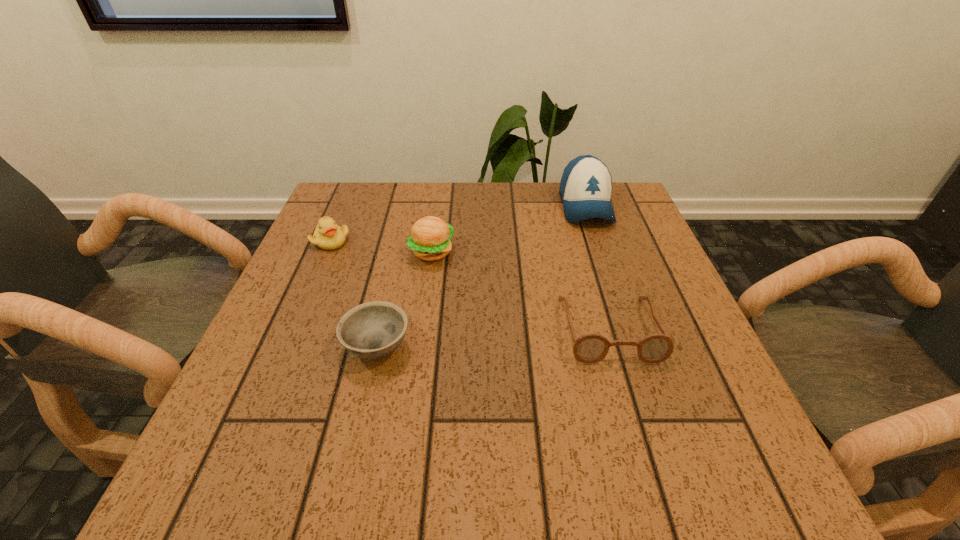
Locate an element on the screen. The height and width of the screenshot is (540, 960). vacant space positioned 0.130m on the right of the bowl is located at coordinates (480, 347).

The width and height of the screenshot is (960, 540). In order to click on object present at the far edge in this screenshot , I will do `click(585, 188)`.

Image resolution: width=960 pixels, height=540 pixels. What are the coordinates of `object present at the left edge` in the screenshot? It's located at (328, 236).

Where is `baseball cap located in the right edge section of the desktop`? Image resolution: width=960 pixels, height=540 pixels. baseball cap located in the right edge section of the desktop is located at coordinates (585, 188).

Where is `spectacles present at the right edge`? The image size is (960, 540). spectacles present at the right edge is located at coordinates (591, 348).

The width and height of the screenshot is (960, 540). Find the location of `object that is at the far right corner`. object that is at the far right corner is located at coordinates (585, 188).

I want to click on vacant space at the far edge, so click(458, 185).

At what (x,y) coordinates should I click in order to perform the action: click on free spot at the left edge of the desktop. Please return your answer as a coordinate pair (x, y). This screenshot has width=960, height=540. Looking at the image, I should click on (334, 330).

The width and height of the screenshot is (960, 540). Find the location of `vacant region at the right edge of the desktop`. vacant region at the right edge of the desktop is located at coordinates (598, 251).

You are a GUI agent. You are given a task and a screenshot of the screen. Output one action in this format:
    pyautogui.click(x=<x>, y=<y>)
    Task: Click on the free space at the far right corner
    
    Given the screenshot: What is the action you would take?
    pyautogui.click(x=613, y=206)